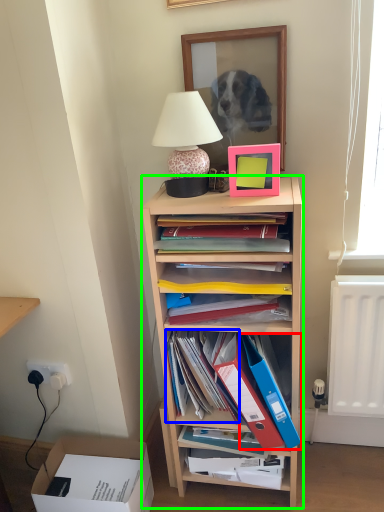
Question: Which object is the closest to the paperback book (highlighted by a red box)? Choose among these: book (highlighted by a blue box) or shelf (highlighted by a green box).

Choices:
 (A) book
 (B) shelf

Answer: (A)